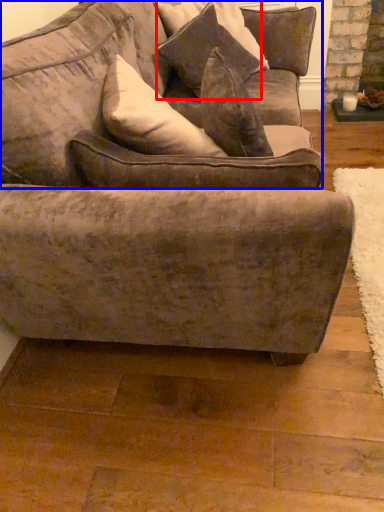
Question: Which point is closer to the camera, pillow (highlighted by a red box) or couch (highlighted by a blue box)?

Choices:
 (A) pillow
 (B) couch

Answer: (B)